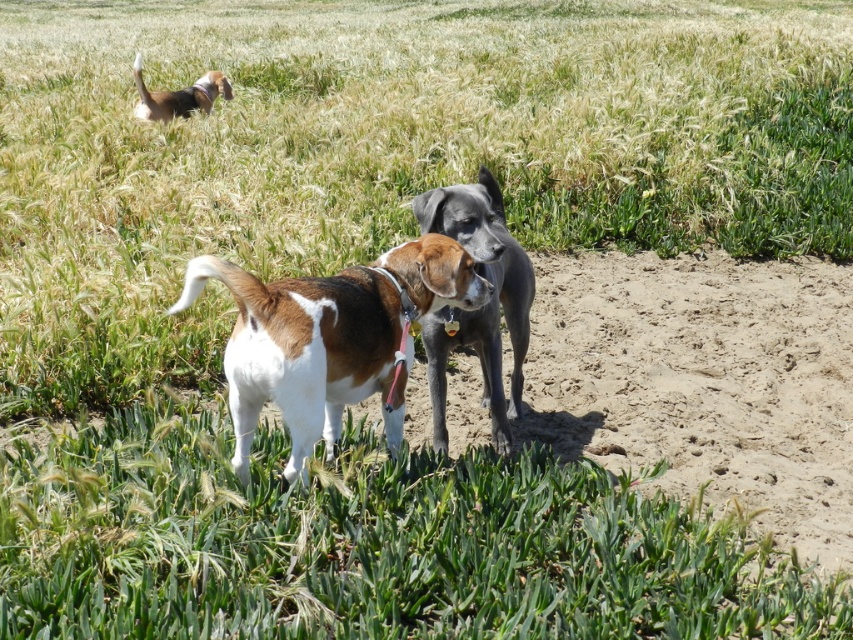
You are standing at the camera position and want to call your dog. Which dog is closest to you, the brown and white fur dog at center or the other dog in the background?

The brown and white fur dog at center is closer to you since it is only 2.89 meters away from the camera position, while the other dog in the background is farther away.

You are standing at the point marked as point (344, 332) in the image. You want to throw a ball to your friend who is standing 5 meters away from you. Will the ball reach your friend if you throw it with a maximum distance of 4 meters?

The distance of point (344, 332) from viewer is 3.27 meters. Since your friend is 5 meters away from you, the ball thrown with a maximum of 4 meters won

You are a photographer trying to capture a photo of the smooth gray dog at center and the brown and white fur at upper left. Which dog is located in a lower position relative to the other?

The smooth gray dog at center is positioned under the brown and white fur at upper left, so it is lower in position.